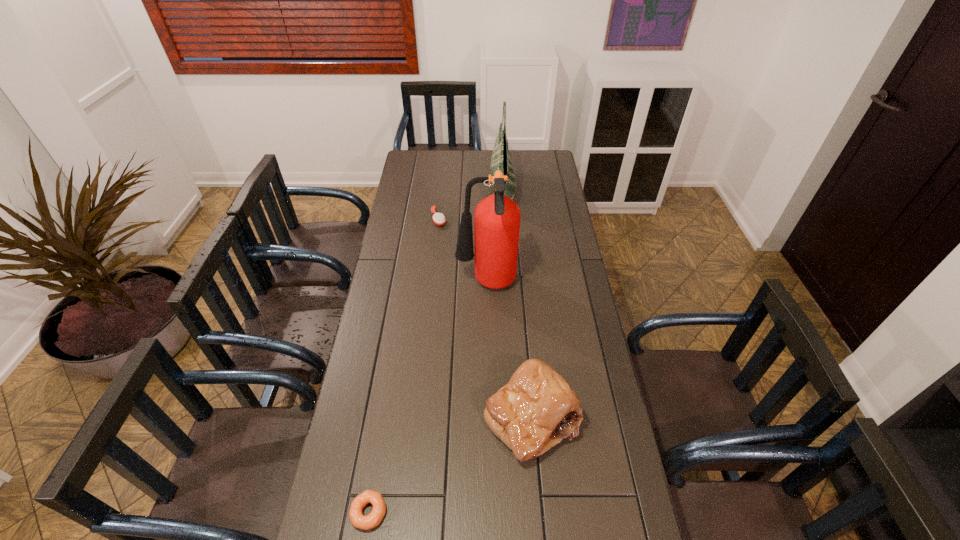
Select which object is the closest to the hairbrush. Please provide its 2D coordinates. Your answer should be formatted as a tuple, i.e. [(x, y)], where the tuple contains the x and y coordinates of a point satisfying the conditions above.

[(500, 160)]

Identify which object is located as the second nearest to the nearest object. Please provide its 2D coordinates. Your answer should be formatted as a tuple, i.e. [(x, y)], where the tuple contains the x and y coordinates of a point satisfying the conditions above.

[(497, 218)]

You are a GUI agent. You are given a task and a screenshot of the screen. Output one action in this format:
    pyautogui.click(x=<x>, y=<y>)
    Task: Click on the vacant space that satisfies the following two spatial constraints: 1. on the back side of the tote bag; 2. on the left side of the fourth object from right to left
    
    Given the screenshot: What is the action you would take?
    [x=442, y=192]

At what (x,y) coordinates should I click in order to perform the action: click on free space that satisfies the following two spatial constraints: 1. at the nozzle of the third nearest object; 2. on the front side of the doughnut. Please return your answer as a coordinate pair (x, y). Looking at the image, I should click on (490, 512).